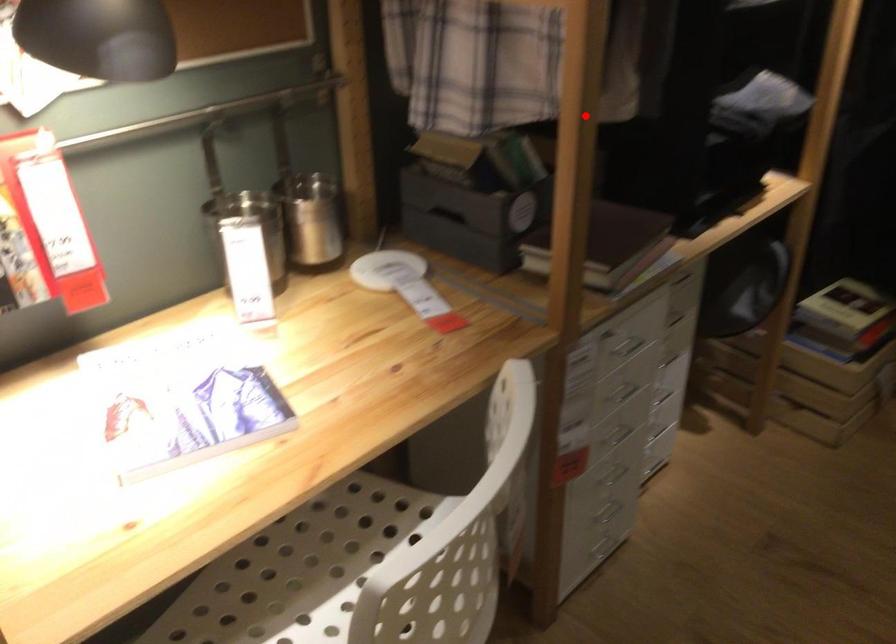
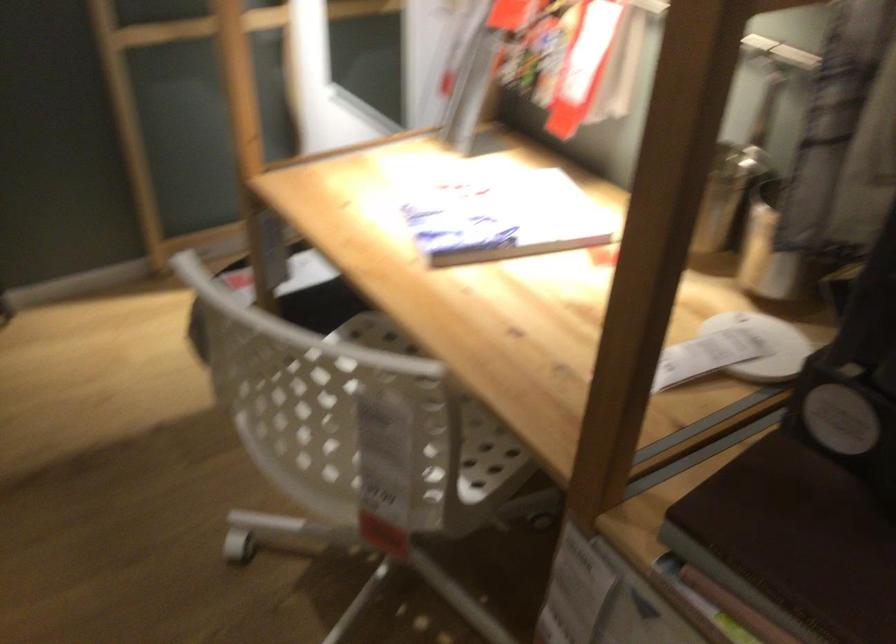
Where in the second image is the point corresponding to the highlighted location from the first image?

(771, 252)